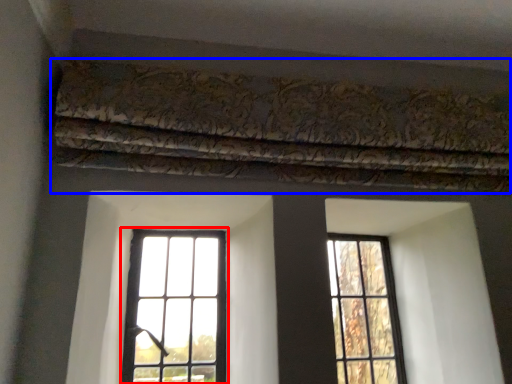
Question: Which point is further to the camera, window (highlighted by a red box) or curtain (highlighted by a blue box)?

Choices:
 (A) window
 (B) curtain

Answer: (A)